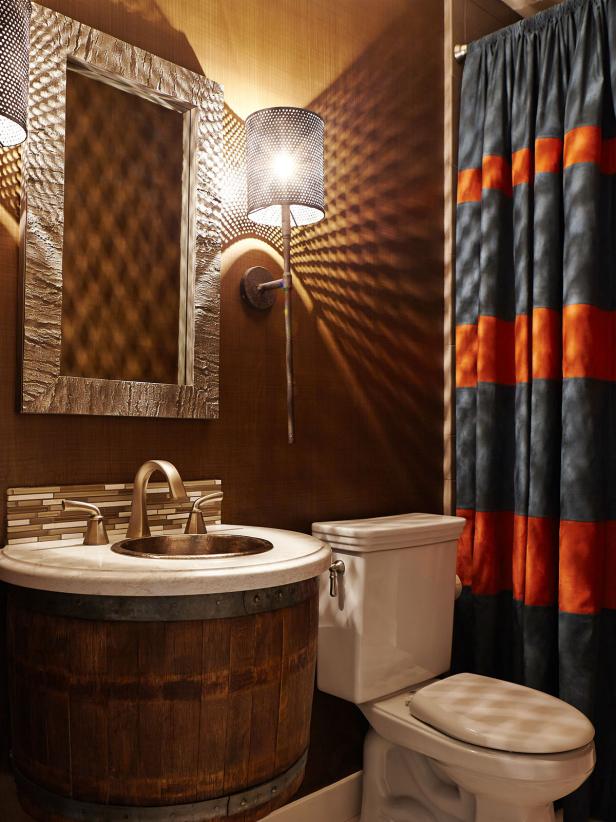
At what (x,y) coordinates should I click in order to perform the action: click on toilet seat lid. Please return your answer as a coordinate pair (x, y). Image resolution: width=616 pixels, height=822 pixels. Looking at the image, I should click on (506, 709).